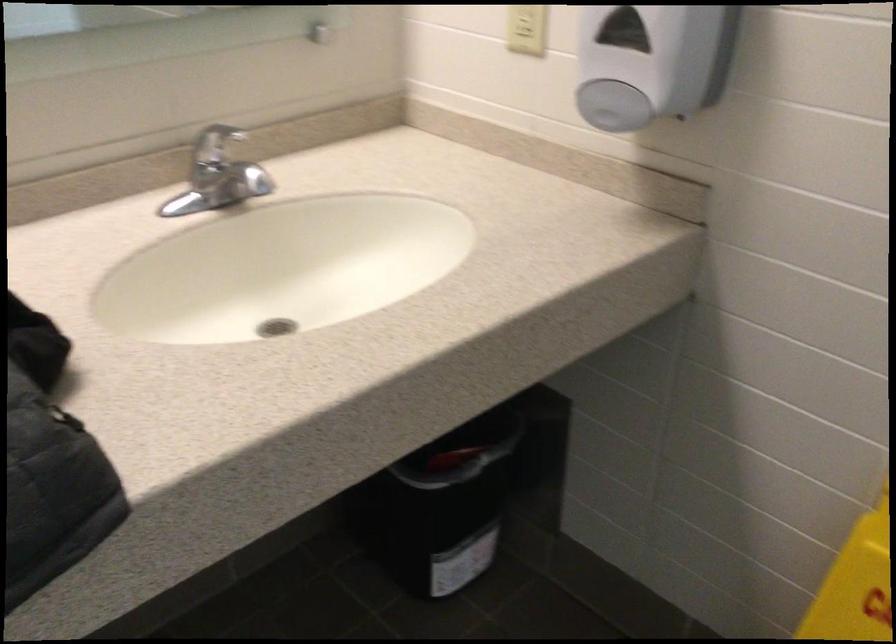
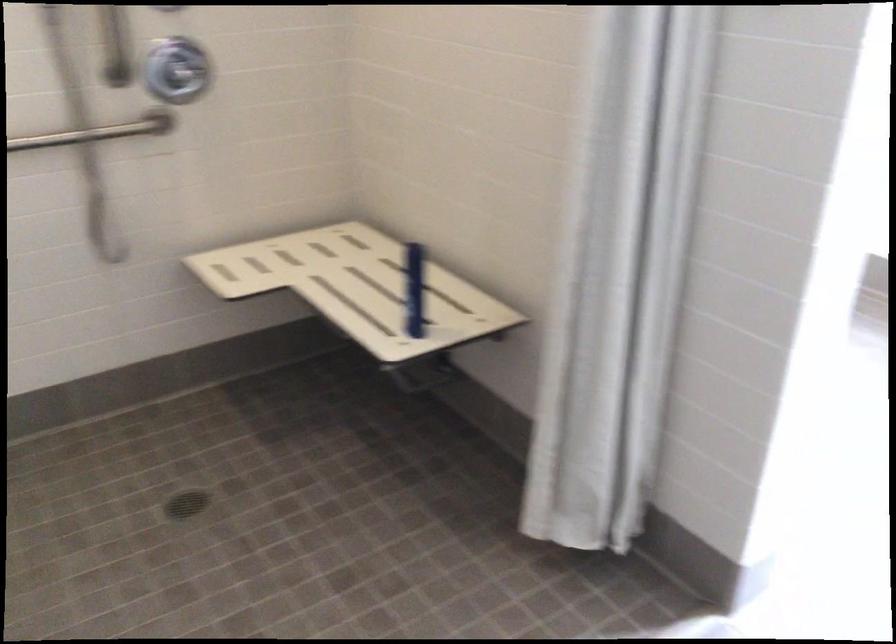
Question: What movement of the cameraman would produce the second image?

Choices:
 (A) Left
 (B) Right
 (C) Forward
 (D) Backward

Answer: (B)